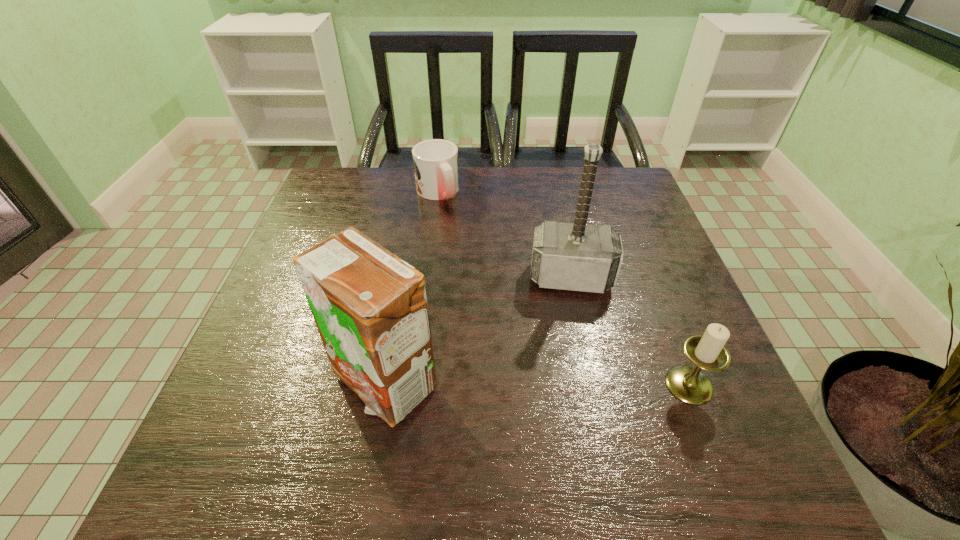
At what (x,y) coordinates should I click in order to perform the action: click on vacant space situated 0.200m for striking with the head of the hammer. Please return your answer as a coordinate pair (x, y). The image size is (960, 540). Looking at the image, I should click on (571, 375).

This screenshot has height=540, width=960. I want to click on vacant space located 0.340m on the side of the shortest object with the handle, so pyautogui.click(x=499, y=288).

Locate an element on the screen. The height and width of the screenshot is (540, 960). free region located 0.270m on the side of the shortest object with the handle is located at coordinates (486, 269).

Identify the location of free space located on the side of the shortest object with the handle. (457, 226).

You are a GUI agent. You are given a task and a screenshot of the screen. Output one action in this format:
    pyautogui.click(x=<x>, y=<y>)
    Task: Click on the object positioned at the far edge
    
    Given the screenshot: What is the action you would take?
    pyautogui.click(x=435, y=161)

Locate an element on the screen. carton at the near edge is located at coordinates (370, 307).

This screenshot has height=540, width=960. What are the coordinates of `candle holder present at the near edge` in the screenshot? It's located at (707, 351).

Locate an element on the screen. candle holder at the right edge is located at coordinates tap(707, 351).

This screenshot has height=540, width=960. I want to click on hammer located in the right edge section of the desktop, so click(576, 256).

I want to click on object that is at the near right corner, so click(x=707, y=351).